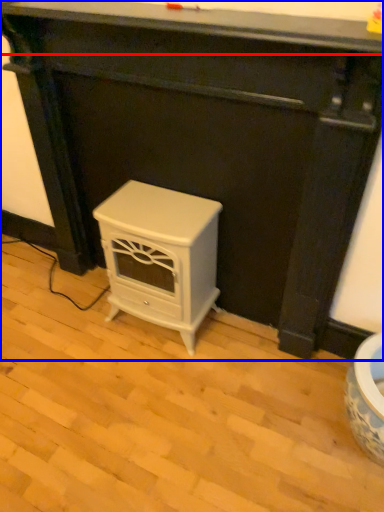
Question: Which of the following is the closest to the observer, counter top (highlighted by a red box) or furniture (highlighted by a blue box)?

Choices:
 (A) counter top
 (B) furniture

Answer: (A)